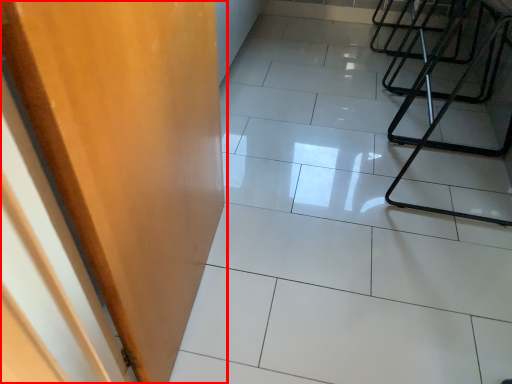
Question: Observing the image, what is the correct spatial positioning of door (annotated by the red box) in reference to ceramic tile?

Choices:
 (A) right
 (B) left

Answer: (B)